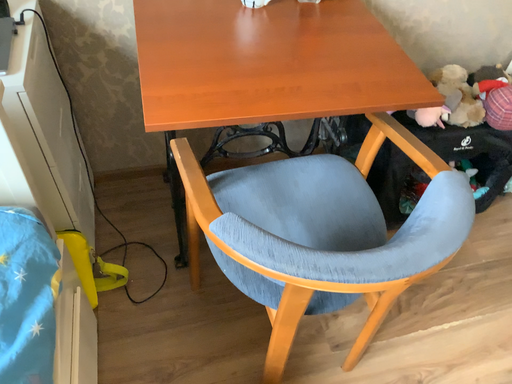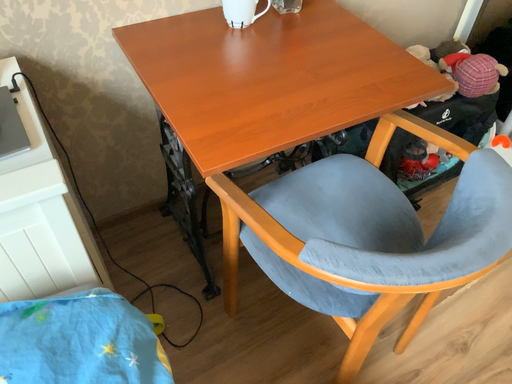
Question: How did the camera likely rotate when shooting the video?

Choices:
 (A) rotated right
 (B) rotated left

Answer: (A)